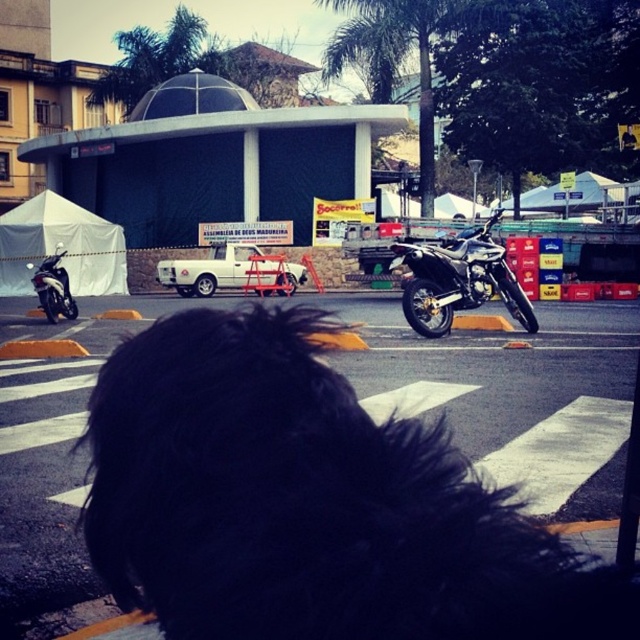
Which is below, black fluffy hair at center or shiny black motorcycle at center?

black fluffy hair at center is below.

Is black fluffy hair at center smaller than shiny black motorcycle at center?

Yes, black fluffy hair at center is smaller than shiny black motorcycle at center.

Identify the location of black fluffy hair at center. The height and width of the screenshot is (640, 640). click(x=308, y=502).

Describe the element at coordinates (308, 502) in the screenshot. I see `black fluffy hair at center` at that location.

Measure the distance between point (316, 454) and camera.

Point (316, 454) and camera are 3.31 feet apart from each other.

What do you see at coordinates (308, 502) in the screenshot?
I see `black fluffy hair at center` at bounding box center [308, 502].

This screenshot has height=640, width=640. I want to click on black fluffy hair at center, so click(x=308, y=502).

Does shiny black motorcycle at center appear under shiny black motorcycle at left?

Yes.

Who is more forward, (440,289) or (51,320)?

Point (440,289) is more forward.

The image size is (640, 640). I want to click on shiny black motorcycle at center, so click(458, 280).